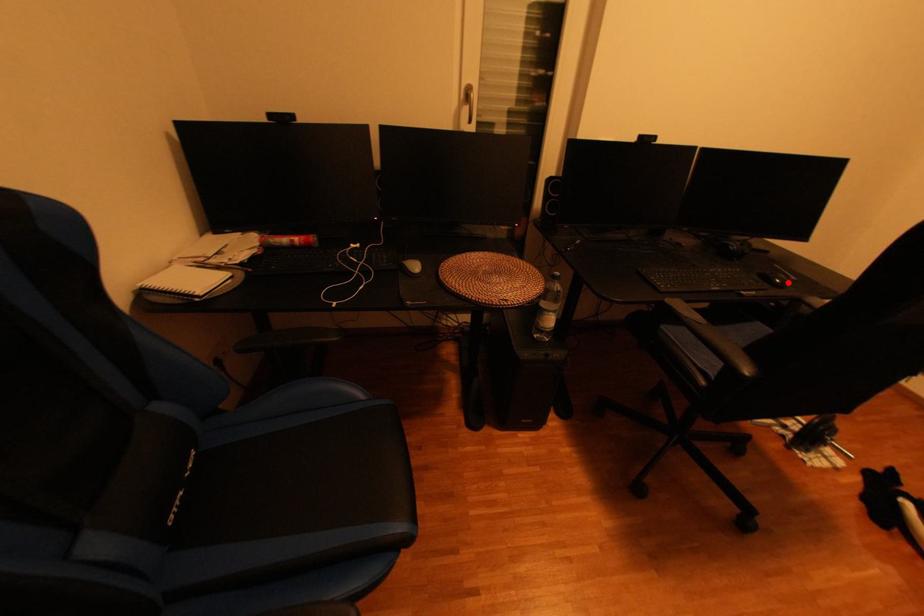
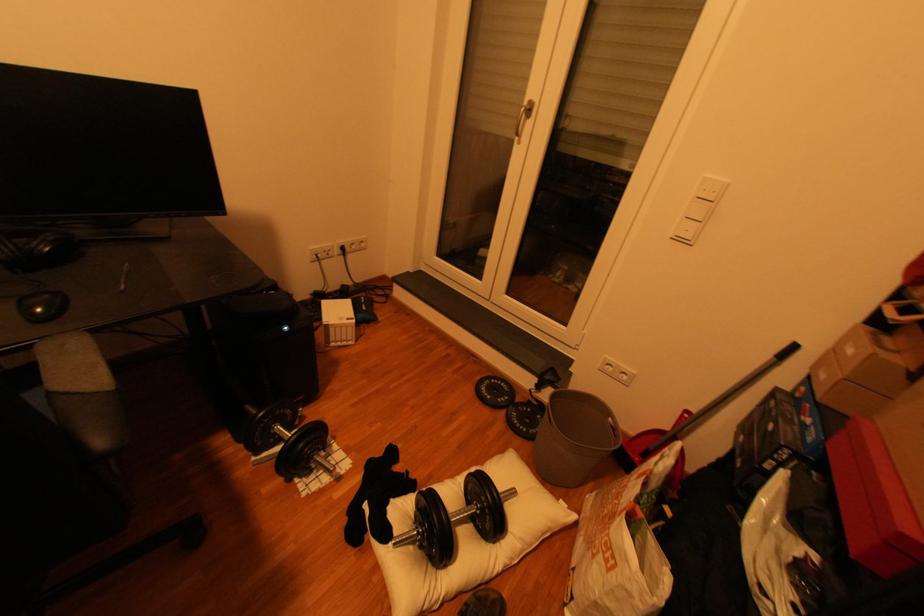
Locate, in the second image, the point that corresponds to the highlighted location in the first image.

(47, 310)